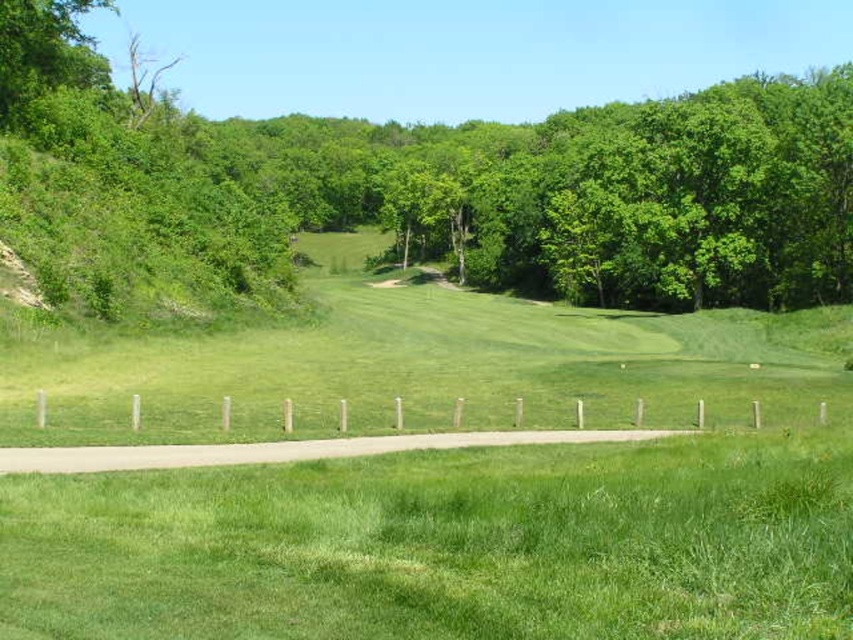
You are standing at the point closer to the camera in the image. Which point are you standing at, point (694,136) or point (631,605)?

You are standing at point (694,136) because it is further to the camera than point (631,605).

You are standing on the green grass at lower center and want to reach the green leafy tree at center. Which direction should you move to get closer to the tree?

You should move upward towards the green leafy tree at center since it is located above the green grass at lower center.